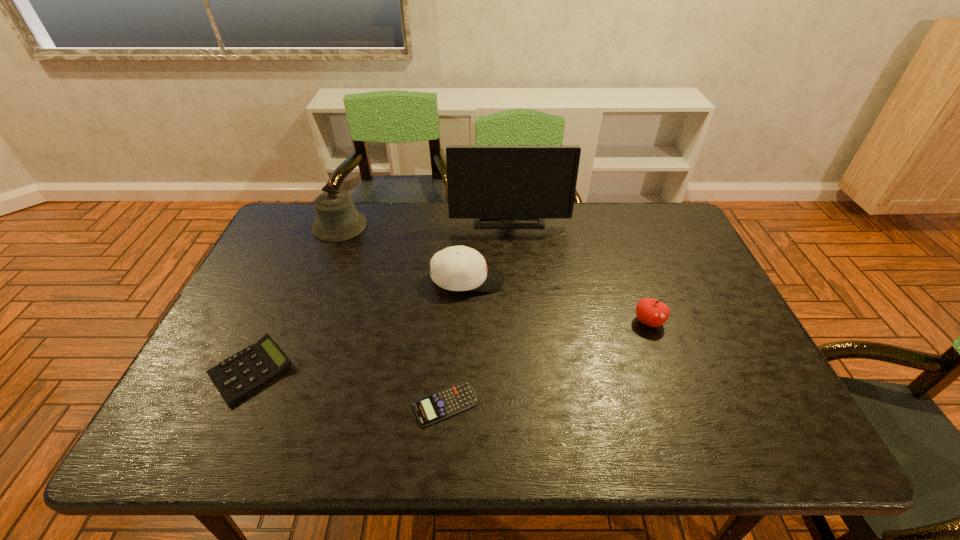
Image resolution: width=960 pixels, height=540 pixels. I want to click on calculator that is at the left edge, so click(241, 374).

Locate an element on the screen. The width and height of the screenshot is (960, 540). object at the far left corner is located at coordinates (337, 219).

Locate an element on the screen. vacant position at the far edge of the desktop is located at coordinates (535, 242).

The image size is (960, 540). I want to click on free space at the near edge of the desktop, so click(556, 454).

At what (x,y) coordinates should I click in order to perform the action: click on vacant space at the left edge of the desktop. Please return your answer as a coordinate pair (x, y). Looking at the image, I should click on (277, 266).

Where is `free space at the far left corner of the desktop`? This screenshot has height=540, width=960. free space at the far left corner of the desktop is located at coordinates (309, 218).

In the image, there is a desktop. Identify the location of vacant space at the near left corner. (204, 451).

This screenshot has height=540, width=960. I want to click on free space at the far right corner, so click(x=664, y=210).

The image size is (960, 540). I want to click on free space between the fifth shortest object and the second shortest object, so click(296, 298).

This screenshot has height=540, width=960. In order to click on vacant point located between the rightmost object and the taller calculator in this screenshot , I will do [x=449, y=346].